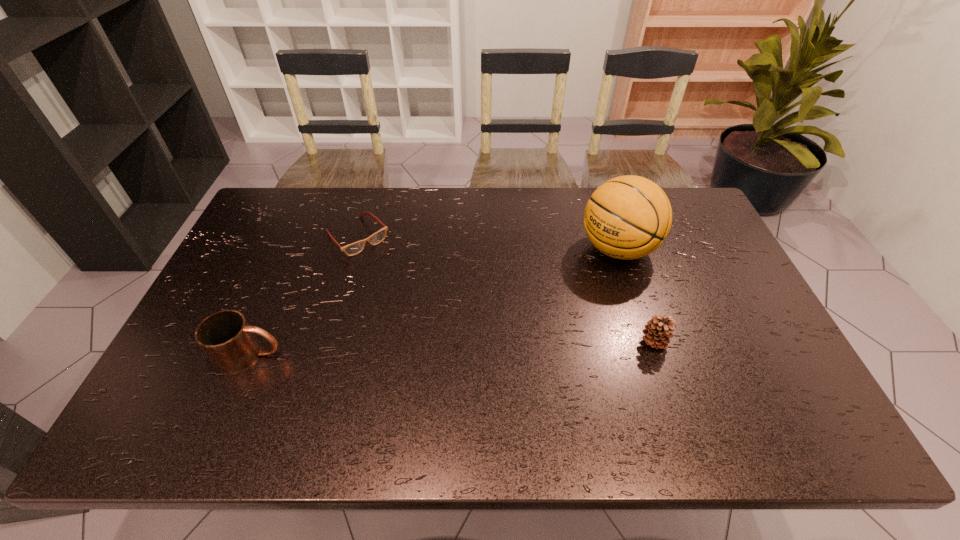
Where is `vacant space at the right edge`? The height and width of the screenshot is (540, 960). vacant space at the right edge is located at coordinates (725, 307).

This screenshot has height=540, width=960. I want to click on free space that is in between the mug and the tallest object, so click(434, 302).

Where is `unoccupied area between the spectacles and the pinecone`? The width and height of the screenshot is (960, 540). unoccupied area between the spectacles and the pinecone is located at coordinates (506, 289).

This screenshot has width=960, height=540. In order to click on vacant area that lies between the spectacles and the basketball in this screenshot , I will do `click(488, 243)`.

Where is `free space between the pinecone and the basketball`? The height and width of the screenshot is (540, 960). free space between the pinecone and the basketball is located at coordinates (636, 295).

Locate an element on the screen. Image resolution: width=960 pixels, height=540 pixels. blank region between the shortest object and the tallest object is located at coordinates (488, 243).

Locate an element on the screen. vacant point located between the shortest object and the pinecone is located at coordinates (506, 289).

The image size is (960, 540). I want to click on vacant space that is in between the pinecone and the mug, so click(452, 348).

Locate an element on the screen. free space between the mug and the pinecone is located at coordinates (452, 348).

Identify the location of vacant area between the mug and the tallest object. (434, 302).